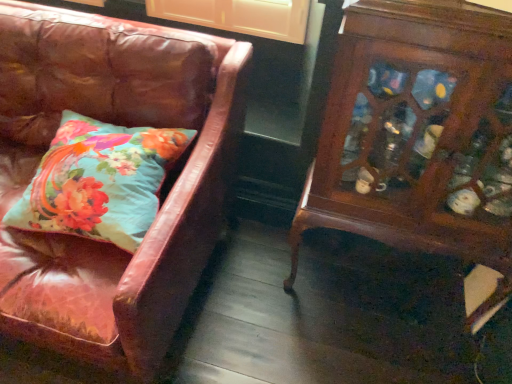
At what (x,y) coordinates should I click in order to perform the action: click on vacant space in wooden cabinet at right (from a real-world perspective). Please return your answer as a coordinate pair (x, y). Looking at the image, I should click on (373, 289).